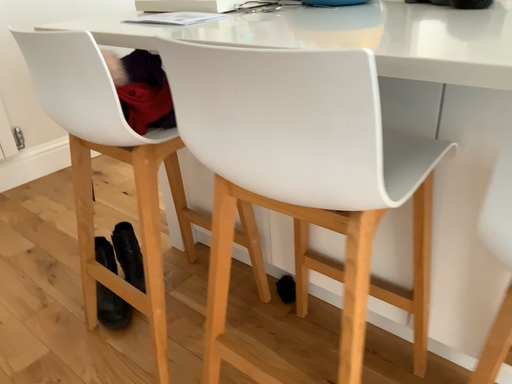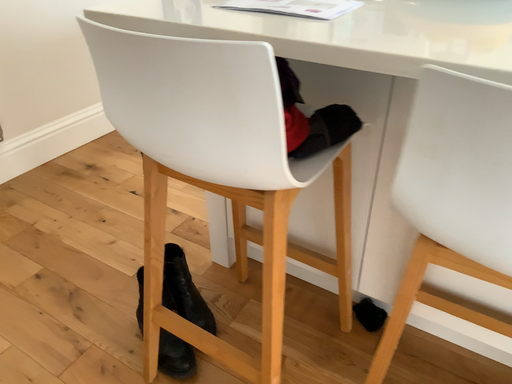
Question: How did the camera likely rotate when shooting the video?

Choices:
 (A) rotated left
 (B) rotated right

Answer: (B)